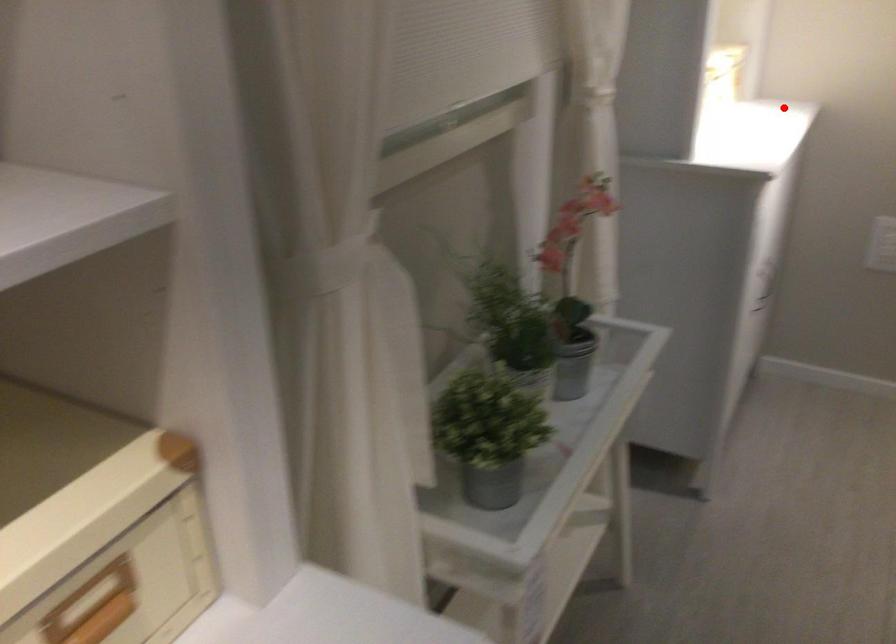
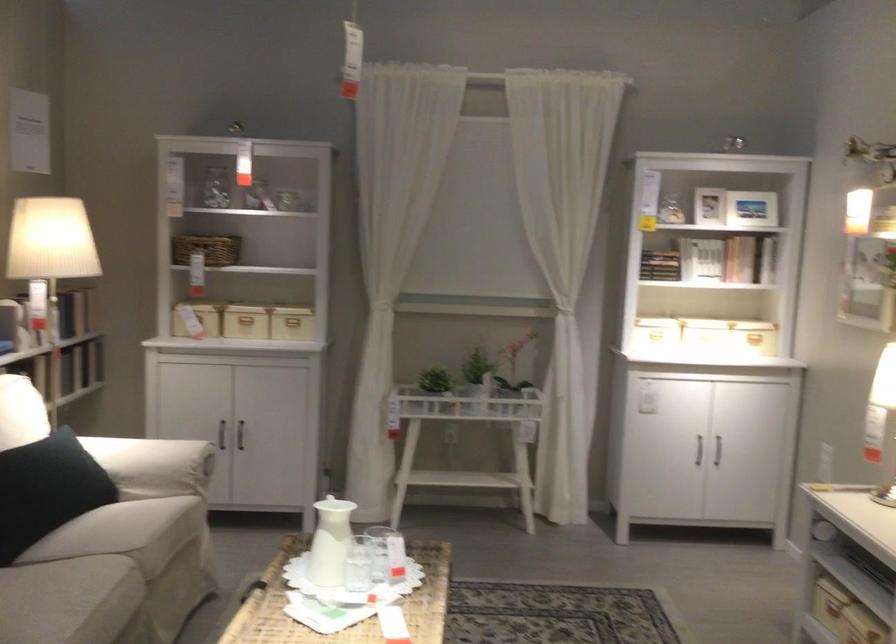
In the second image, find the point that corresponds to the highlighted location in the first image.

(755, 339)